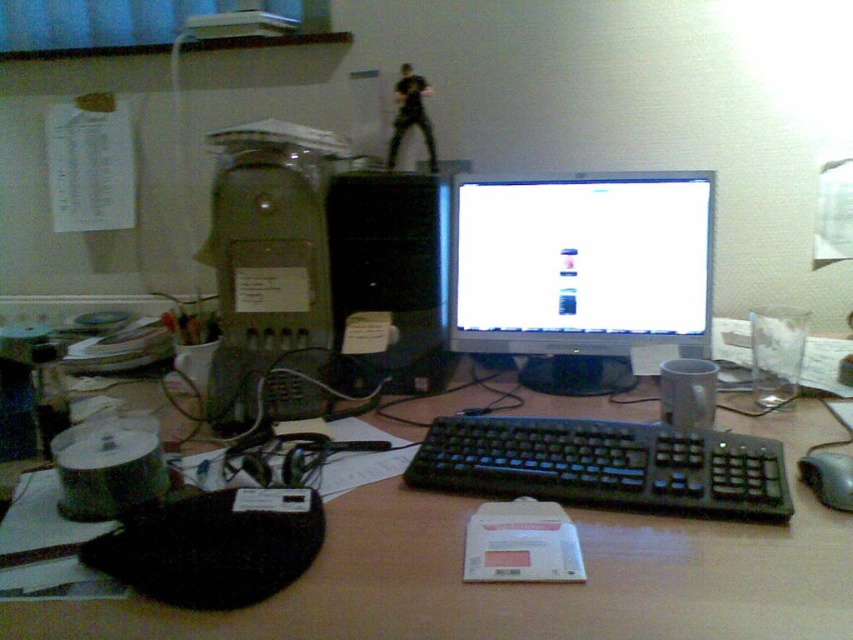
You are organizing your desk and need to move the matte gray desktop computer at center and the black plastic keyboard at center. If you want to place them side by side horizontally, which one should be on the left to maintain their current relative position?

The matte gray desktop computer at center should be on the left since it is currently to the left of the black plastic keyboard at center.

You are organizing your desk and want to place a 30 cm wide laptop between the matte gray desktop computer at center and the black plastic keyboard at center. Is there enough space between them to fit the laptop?

The distance between the matte gray desktop computer at center and the black plastic keyboard at center is 40.14 centimeters. Since the laptop is only 30 cm wide, there is sufficient space to place it between them.